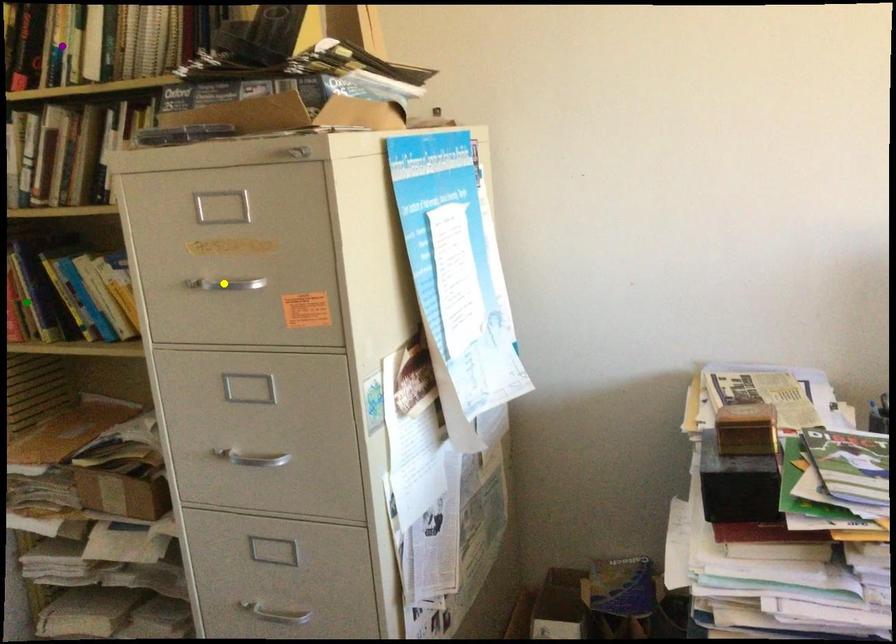
Order these from farthest to nearest:
A) green point
B) yellow point
C) purple point

green point → purple point → yellow point